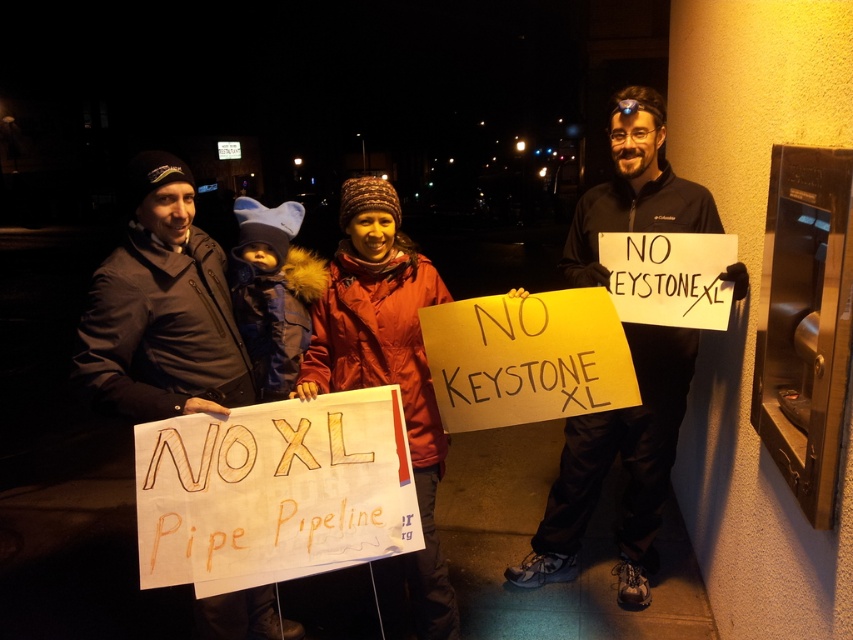
Which is behind, point (734, 280) or point (86, 385)?

The point (734, 280) is behind.

Does matte black jacket at right appear over dark gray jacket at center?

Actually, matte black jacket at right is below dark gray jacket at center.

Who is more forward, (x=653, y=492) or (x=132, y=237)?

Point (x=132, y=237) is more forward.

The width and height of the screenshot is (853, 640). Find the location of `matte black jacket at right`. matte black jacket at right is located at coordinates (624, 467).